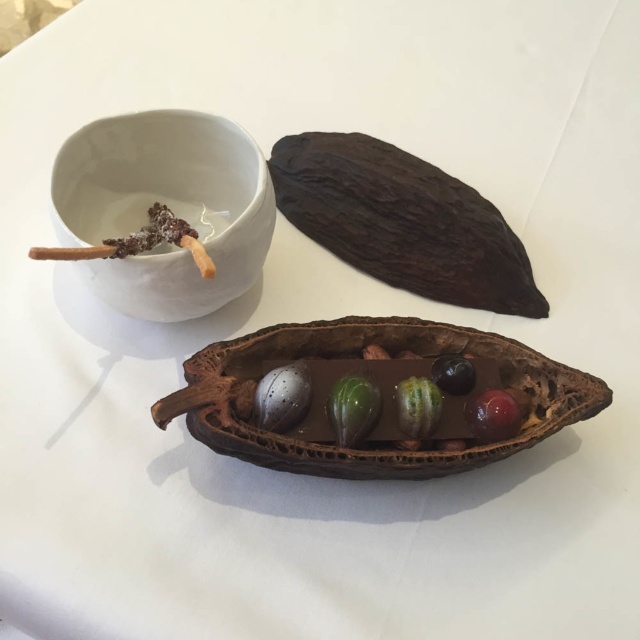
Who is positioned more to the left, dark brown textured pod at upper center or glossy red berry at center?

dark brown textured pod at upper center is more to the left.

Who is more distant from viewer, [291,168] or [486,428]?

Positioned behind is point [291,168].

Does point (374, 173) come behind point (513, 397)?

Yes.

Find the location of a particular element. This screenshot has width=640, height=640. dark brown textured pod at upper center is located at coordinates (403, 221).

Between white ceramic bowl at upper left and shiny dark blue berry at center, which one appears on the right side from the viewer's perspective?

From the viewer's perspective, shiny dark blue berry at center appears more on the right side.

Does white ceramic bowl at upper left have a smaller size compared to shiny dark blue berry at center?

No.

Is point (186, 141) positioned after point (452, 394)?

Yes, it is behind point (452, 394).

The width and height of the screenshot is (640, 640). I want to click on white ceramic bowl at upper left, so click(166, 204).

Between point (355, 442) and point (486, 422), which one is positioned behind?

Point (355, 442)

Is point (371, 396) closer to viewer compared to point (500, 436)?

That is False.

Find the location of `green glossy chocolate at center`. green glossy chocolate at center is located at coordinates (353, 408).